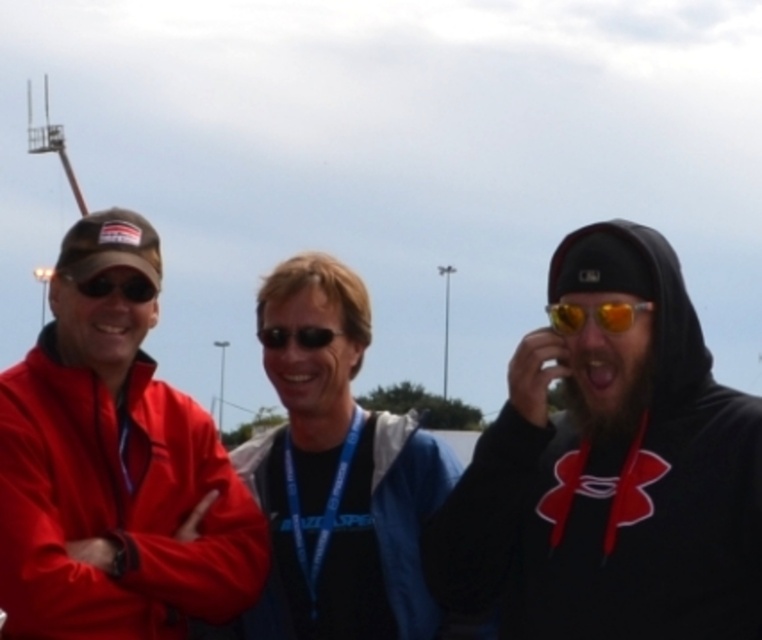
Between point (684, 563) and point (290, 330), which one is positioned in front?

Point (684, 563)

Is point (267, 497) positioned in front of point (298, 342)?

No, it is not.

Locate an element on the screen. The image size is (762, 640). red matte jacket at left is located at coordinates (612, 476).

Does red matte jacket at left have a lesser width compared to matte black sunglasses at center?

Incorrect, red matte jacket at left's width is not less than matte black sunglasses at center's.

Is red matte jacket at left taller than matte black sunglasses at center?

Indeed, red matte jacket at left has a greater height compared to matte black sunglasses at center.

At what (x,y) coordinates should I click in order to perform the action: click on red matte jacket at left. Please return your answer as a coordinate pair (x, y). Image resolution: width=762 pixels, height=640 pixels. Looking at the image, I should click on coord(612,476).

Which of these two, matte red jacket at left or blue fabric jacket at center, stands taller?

With more height is matte red jacket at left.

Is matte red jacket at left wider than blue fabric jacket at center?

Correct, the width of matte red jacket at left exceeds that of blue fabric jacket at center.

Locate an element on the screen. matte red jacket at left is located at coordinates click(x=114, y=467).